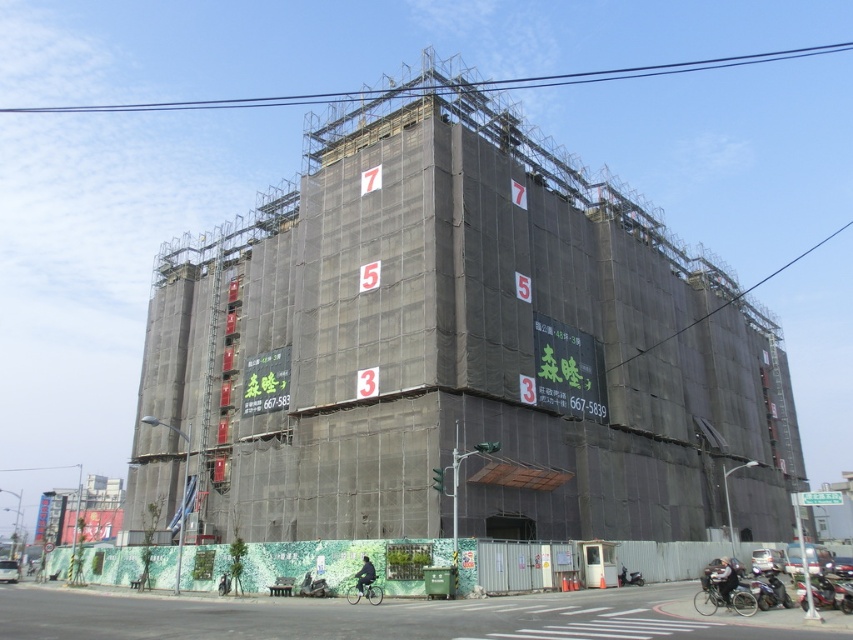
Question: Which point appears closest to the camera in this image?

Choices:
 (A) (579, 593)
 (B) (527, 464)

Answer: (A)

Question: Among these points, which one is nearest to the camera?

Choices:
 (A) (474, 621)
 (B) (285, 196)

Answer: (A)

Question: Does black fabric scaffolding at center appear over green textured wall at lower center?

Choices:
 (A) yes
 (B) no

Answer: (A)

Question: Is the position of black fabric scaffolding at center more distant than that of green textured wall at lower center?

Choices:
 (A) no
 (B) yes

Answer: (B)

Question: Is black fabric scaffolding at center bigger than green textured wall at lower center?

Choices:
 (A) yes
 (B) no

Answer: (A)